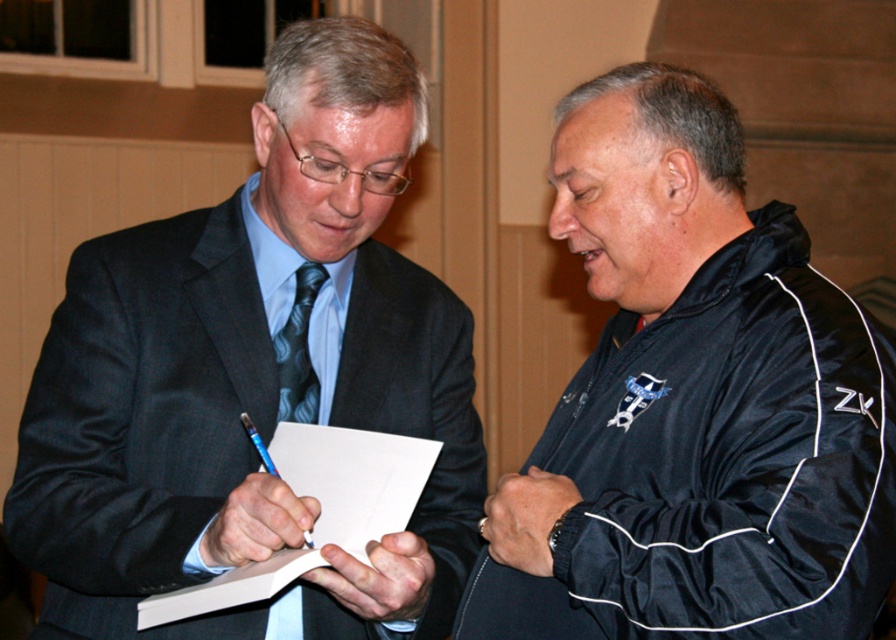
You are a photographer at a formal event. You need to capture a photo of the matte black suit at center and the matte black tie at left. Since both are dark, you want to ensure they are distinguishable in the photo. Based on their positions, which one will appear larger in the photo?

The matte black suit at center will appear larger in the photo because it is positioned over the matte black tie at left, making it closer to the camera and thus larger in the frame.